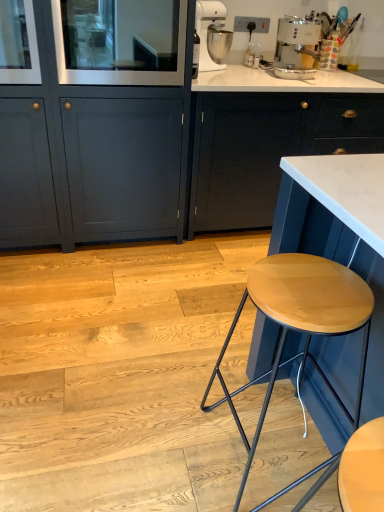
Find the location of `empty space that is ontop of wooden stool at right (from a real-world perspective)`. empty space that is ontop of wooden stool at right (from a real-world perspective) is located at coordinates (309, 287).